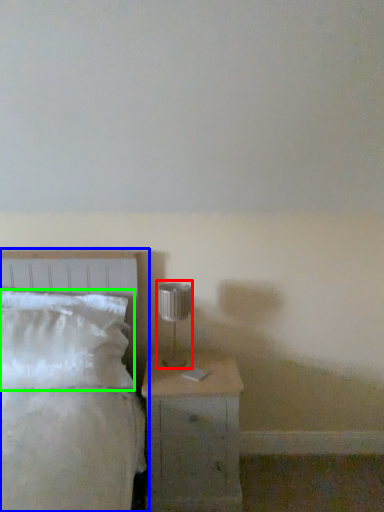
Question: Which object is the closest to the table lamp (highlighted by a red box)? Choose among these: bed (highlighted by a blue box) or pillow (highlighted by a green box).

Choices:
 (A) bed
 (B) pillow

Answer: (A)